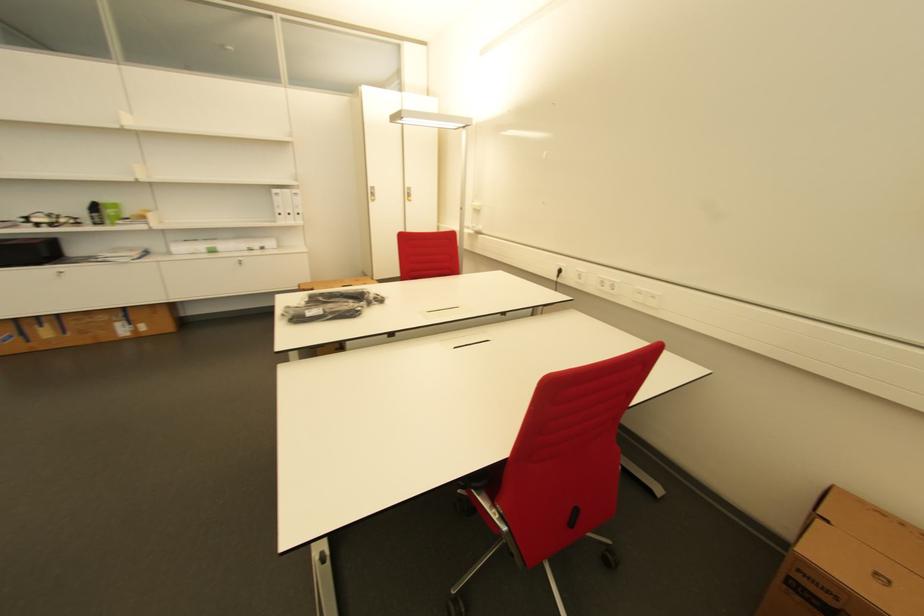
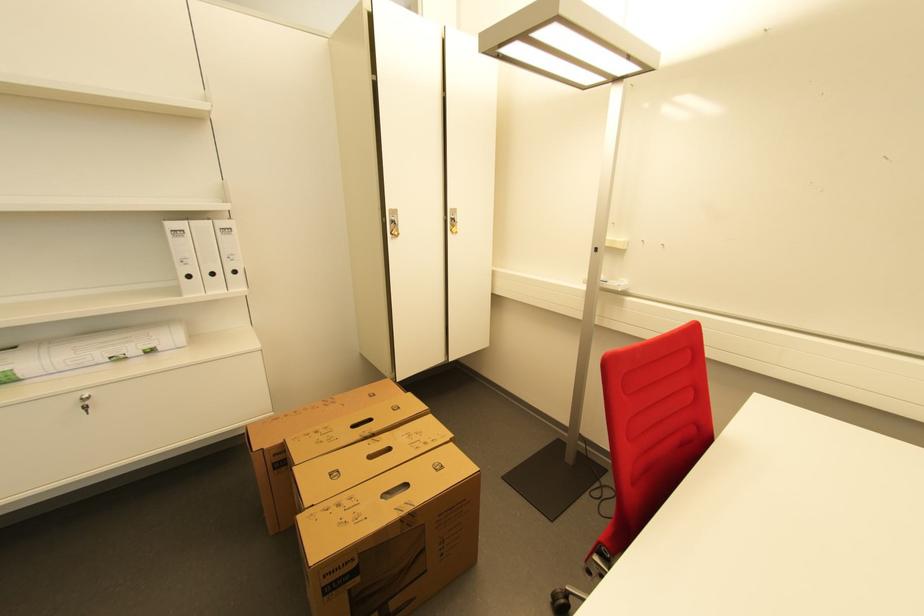
Where in the second image is the point corresponding to point (280, 192) from the first image?

(176, 225)